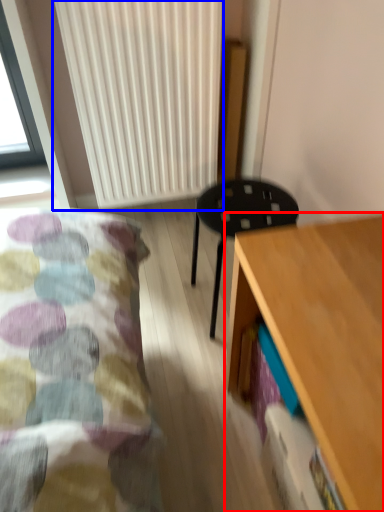
Question: Which object is further to the camera taking this photo, desk (highlighted by a red box) or radiator (highlighted by a blue box)?

Choices:
 (A) desk
 (B) radiator

Answer: (B)